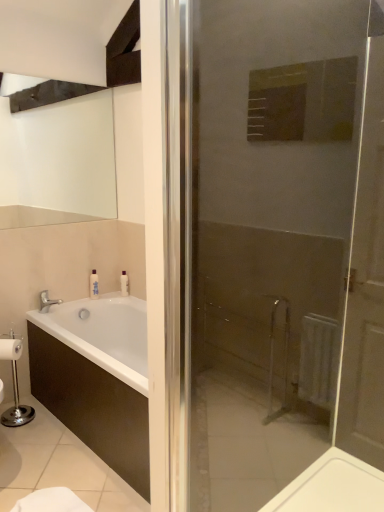
Measure the distance between white wooden door at center and camera.

The distance of white wooden door at center from camera is 1.02 meters.

What do you see at coordinates (275, 243) in the screenshot? This screenshot has height=512, width=384. I see `white wooden door at center` at bounding box center [275, 243].

Describe the element at coordinates (94, 285) in the screenshot. Image resolution: width=384 pixels, height=512 pixels. I see `white glossy bottle at upper left` at that location.

This screenshot has height=512, width=384. I want to click on white wooden door at center, so click(x=275, y=243).

Locate an element on the screen. toiletry behind the silver metallic faucet at lower left is located at coordinates (94, 285).

Based on the photo, from the image's perspective, which one is positioned higher, white glossy bottle at upper left or silver metallic faucet at lower left?

From the image's view, white glossy bottle at upper left is above.

Does white glossy bottle at upper left turn towards silver metallic faucet at lower left?

No, white glossy bottle at upper left is not facing towards silver metallic faucet at lower left.

Looking at their sizes, would you say white glossy bottle at upper left is wider or thinner than silver metallic faucet at lower left?

white glossy bottle at upper left is thinner than silver metallic faucet at lower left.

Consider the image. From the image's perspective, is white wooden door at center above or below white glossy bottle at upper left?

From the image's perspective, white wooden door at center appears above white glossy bottle at upper left.

Is the surface of white wooden door at center in direct contact with white glossy bottle at upper left?

No, white wooden door at center is not beside white glossy bottle at upper left.

How much distance is there between white wooden door at center and white glossy bottle at upper left?

white wooden door at center and white glossy bottle at upper left are 6.22 feet apart from each other.

From a real-world perspective, does white wooden door at center sit lower than white glossy bottle at upper left?

Incorrect, from a real-world perspective, white wooden door at center is higher than white glossy bottle at upper left.

Is silver metallic faucet at lower left next to white glossy bottle at upper left?

No, silver metallic faucet at lower left is not with white glossy bottle at upper left.

Is point (46, 310) positioned before point (96, 276)?

Yes, it is in front of point (96, 276).

Is silver metallic faucet at lower left located outside white glossy bottle at upper left?

Yes.

You are a GUI agent. You are given a task and a screenshot of the screen. Output one action in this format:
    pyautogui.click(x=<x>, y=<y>)
    Task: Click on the toiletry above the silver metallic faucet at lower left (from the image's perspective)
    
    Given the screenshot: What is the action you would take?
    pyautogui.click(x=94, y=285)

Can you confirm if white glossy bottle at upper left is thinner than white wooden door at center?

Correct, the width of white glossy bottle at upper left is less than that of white wooden door at center.

Is the position of white glossy bottle at upper left more distant than that of white wooden door at center?

Yes, the depth of white glossy bottle at upper left is greater than that of white wooden door at center.

Considering the sizes of white glossy bottle at upper left and white wooden door at center in the image, is white glossy bottle at upper left taller or shorter than white wooden door at center?

Considering their sizes, white glossy bottle at upper left has less height than white wooden door at center.

From a real-world perspective, between white glossy bottle at upper left and white wooden door at center, who is vertically lower?

From a 3D spatial view, white glossy bottle at upper left is below.

Is point (378, 302) positioned after point (48, 306)?

No, (378, 302) is in front of (48, 306).

From the picture: Does white wooden door at center have a larger size compared to silver metallic faucet at lower left?

Correct, white wooden door at center is larger in size than silver metallic faucet at lower left.

Can we say white wooden door at center lies outside silver metallic faucet at lower left?

Yes, white wooden door at center is located beyond the bounds of silver metallic faucet at lower left.

Does silver metallic faucet at lower left have a larger size compared to white wooden door at center?

No, silver metallic faucet at lower left is not bigger than white wooden door at center.

From the image's perspective, would you say silver metallic faucet at lower left is positioned over white wooden door at center?

No, from the image's perspective, silver metallic faucet at lower left is not above white wooden door at center.

Is point (48, 300) positioned before point (323, 420)?

No, it is behind (323, 420).

The image size is (384, 512). Identify the location of tap behind the white wooden door at center. (47, 301).

Identify the location of toiletry that is behind the silver metallic faucet at lower left. Image resolution: width=384 pixels, height=512 pixels. (94, 285).

Locate an element on the screen. The width and height of the screenshot is (384, 512). door above the white glossy bottle at upper left (from the image's perspective) is located at coordinates (275, 243).

Estimate the real-world distances between objects in this image. Which object is closer to silver metallic faucet at lower left, white wooden door at center or white glossy bottle at upper left?

white glossy bottle at upper left is closer to silver metallic faucet at lower left.

Based on their spatial positions, is white glossy bottle at upper left or white wooden door at center further from silver metallic faucet at lower left?

Based on the image, white wooden door at center appears to be further to silver metallic faucet at lower left.

Looking at the image, which one is located further to white glossy bottle at upper left, silver metallic faucet at lower left or white wooden door at center?

Among the two, white wooden door at center is located further to white glossy bottle at upper left.

Consider the image. When comparing their distances from white wooden door at center, does silver metallic faucet at lower left or white glossy bottle at upper left seem closer?

white glossy bottle at upper left is closer to white wooden door at center.

Estimate the real-world distances between objects in this image. Which object is closer to white wooden door at center, white glossy bottle at upper left or silver metallic faucet at lower left?

white glossy bottle at upper left is positioned closer to the anchor white wooden door at center.

Considering their positions, is white wooden door at center positioned closer to white glossy bottle at upper left than silver metallic faucet at lower left?

Based on the image, silver metallic faucet at lower left appears to be nearer to white glossy bottle at upper left.

The image size is (384, 512). Identify the location of tap between white wooden door at center and white glossy bottle at upper left along the z-axis. (47, 301).